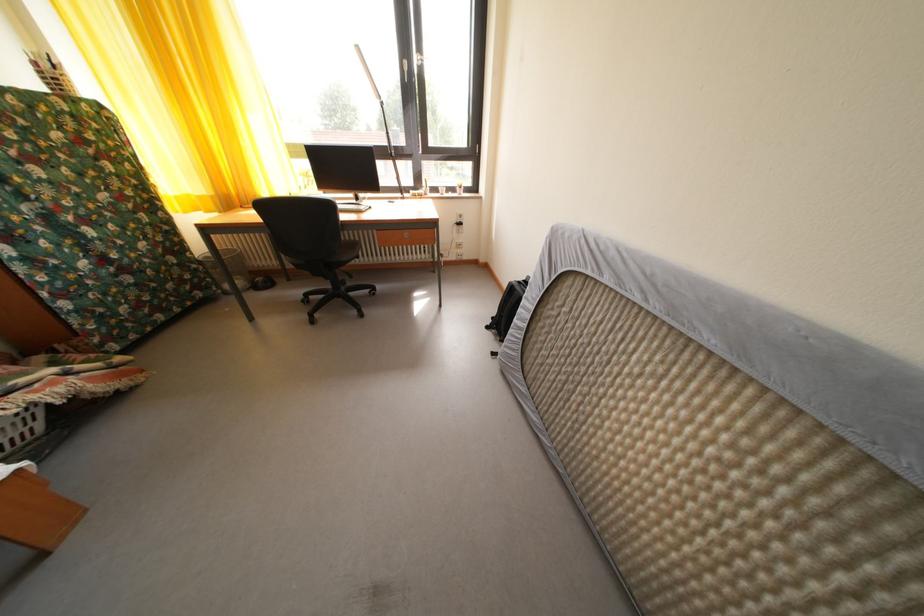
Find the location of a particular element. silver window handle is located at coordinates (407, 69).